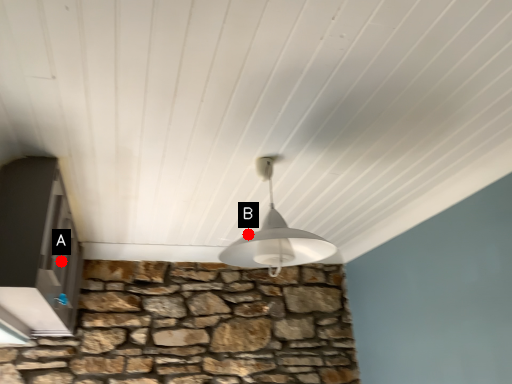
Question: Two points are circled on the image, labeled by A and B beside each circle. Which point is further to the camera?

Choices:
 (A) A is further
 (B) B is further

Answer: (B)